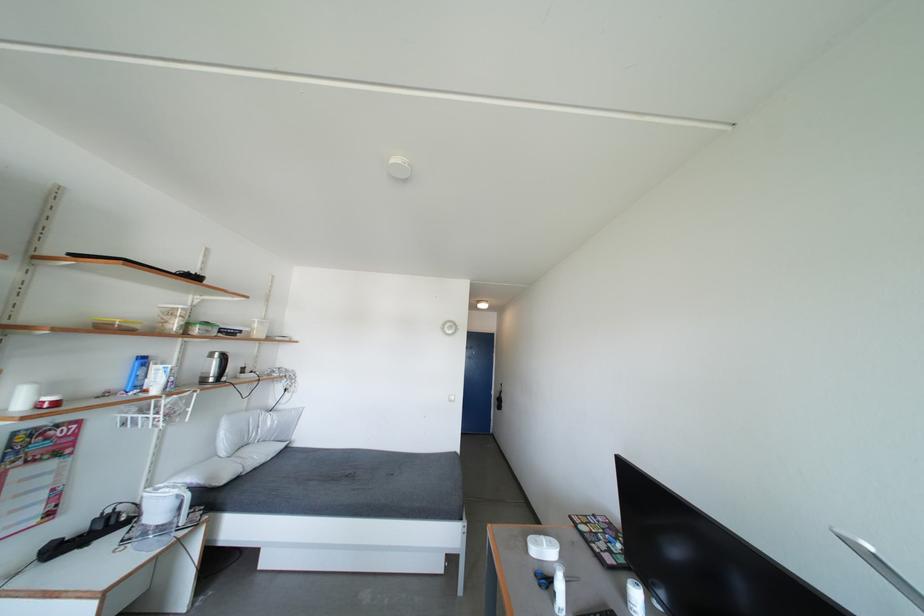
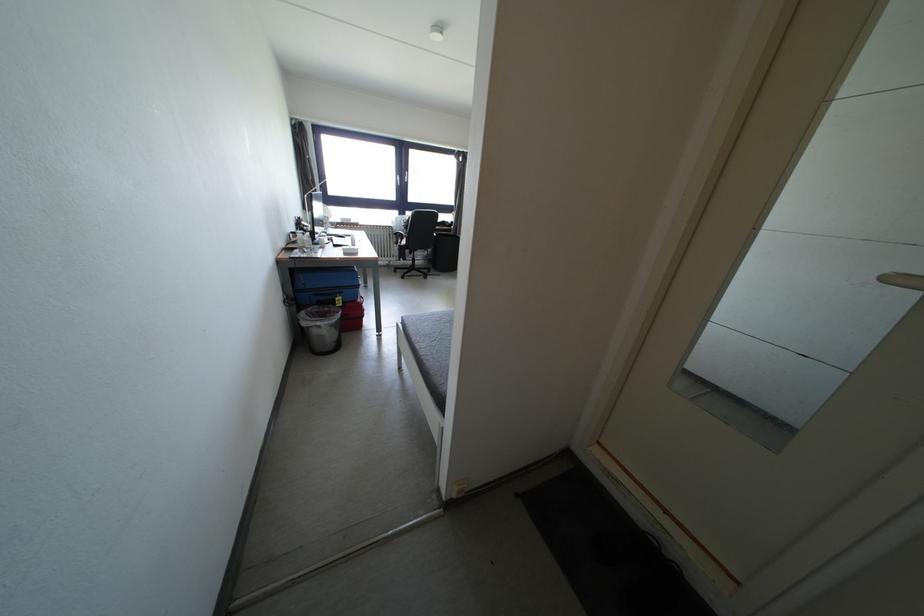
Question: I am providing you with two images of the same scene from different viewpoints. After the viewpoint changes to image2, which objects are now occluded?

Choices:
 (A) blue suitcase
 (B) chair sitting surface
 (C) black stickered case
 (D) cabinet lock key

Answer: (C)